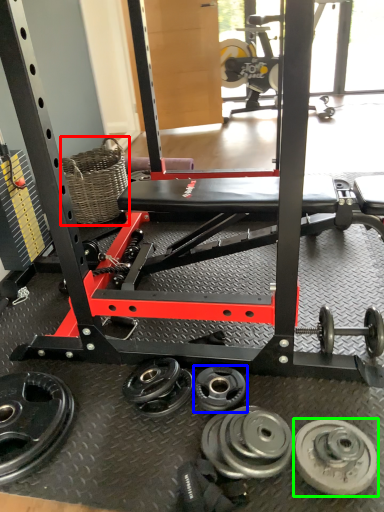
Question: Considering the real-world distances, which object is farthest from basket (highlighted by a red box)? wheel (highlighted by a blue box) or wheel (highlighted by a green box)?

Choices:
 (A) wheel
 (B) wheel

Answer: (B)